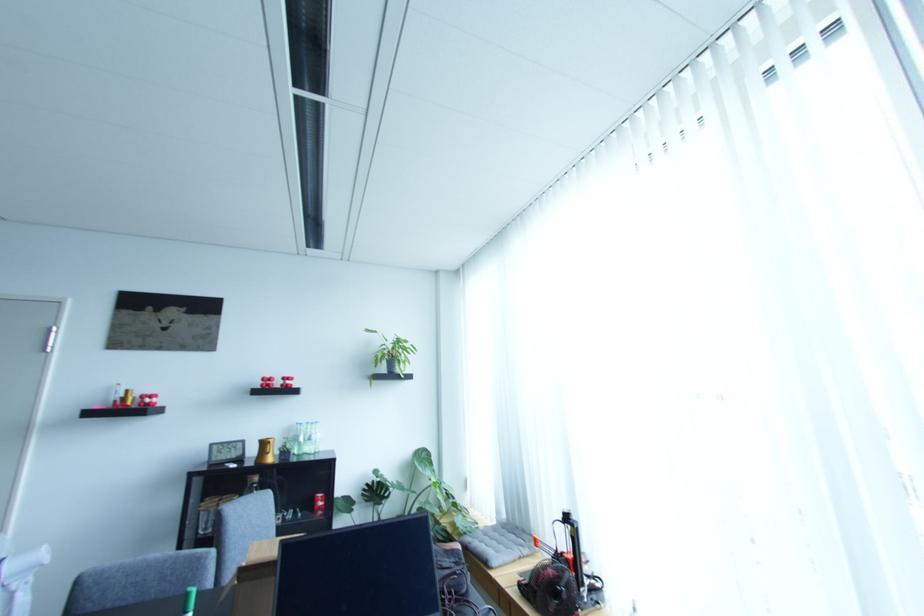
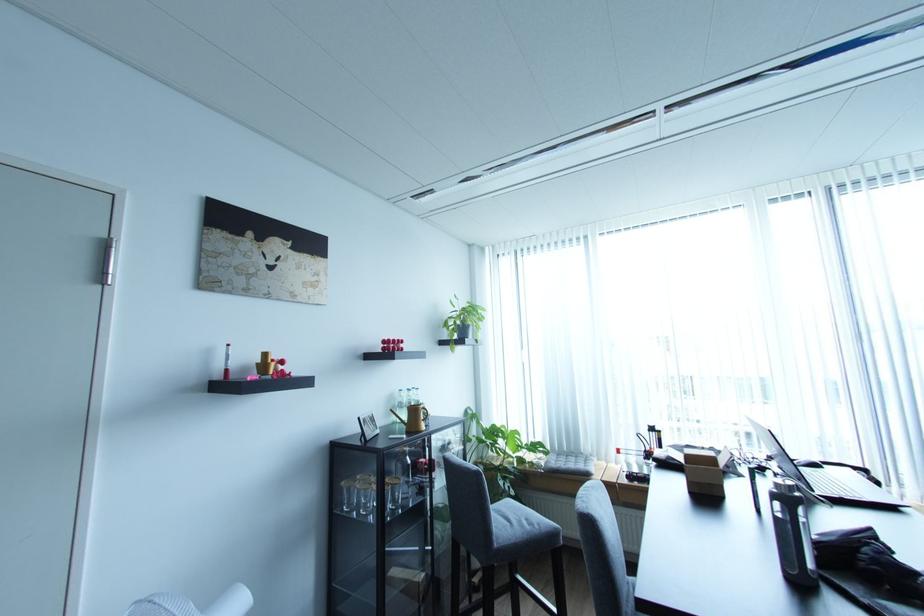
The point at (115, 406) is marked in the first image. Where is the corresponding point in the second image?

(222, 377)